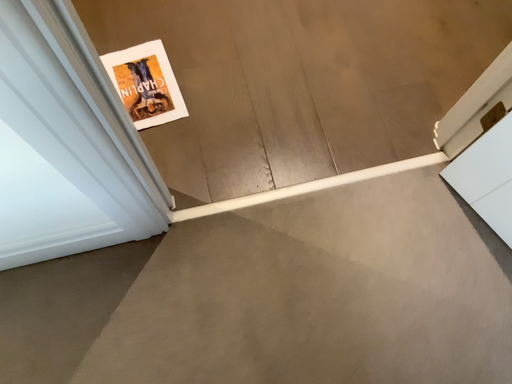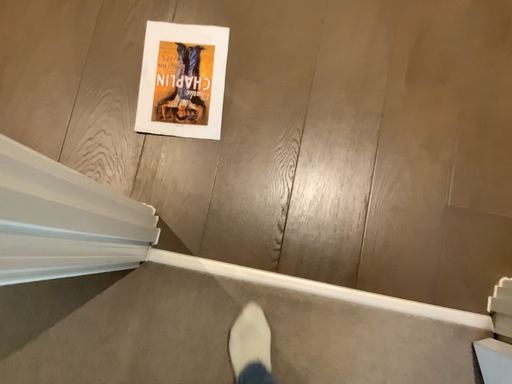
Question: How did the camera likely rotate when shooting the video?

Choices:
 (A) rotated downward
 (B) rotated upward

Answer: (A)